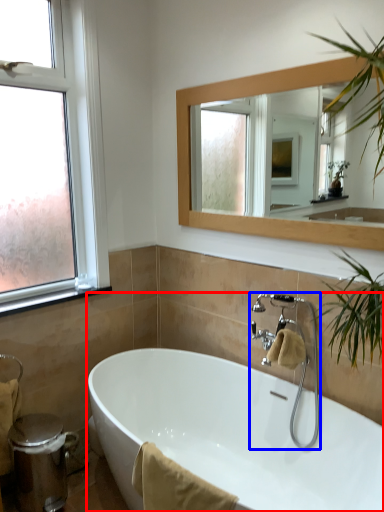
Question: Which of the following is the closest to the observer, bathtub (highlighted by a red box) or tap (highlighted by a blue box)?

Choices:
 (A) bathtub
 (B) tap

Answer: (A)